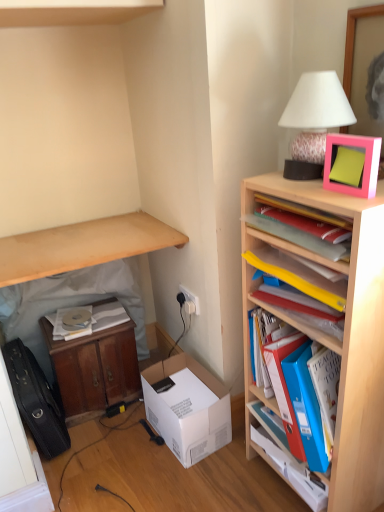
Where is `vacant area that is in front of white cardboard box at lower center`? vacant area that is in front of white cardboard box at lower center is located at coordinates tap(198, 482).